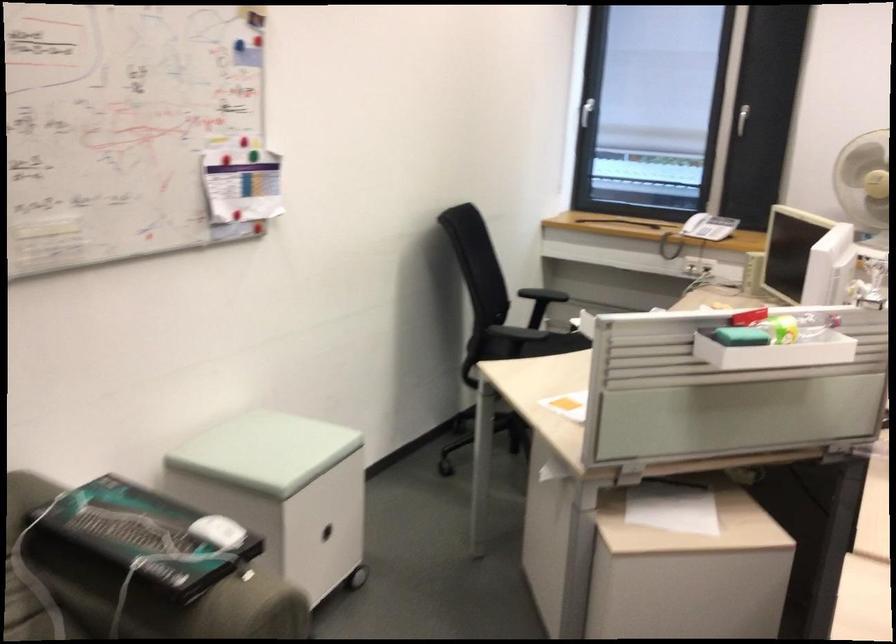
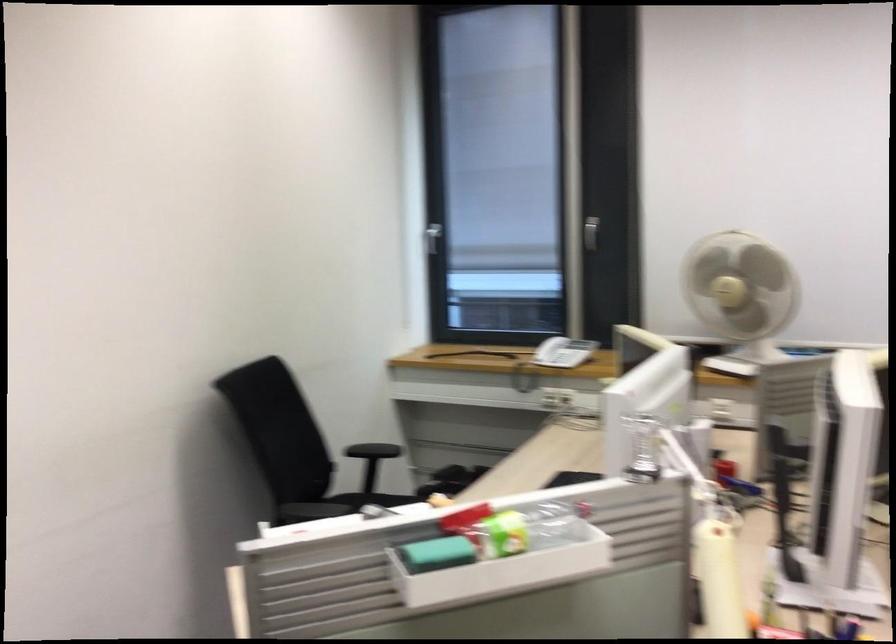
Which direction would the cameraman need to move to produce the second image?

The cameraman walked toward right, forward.